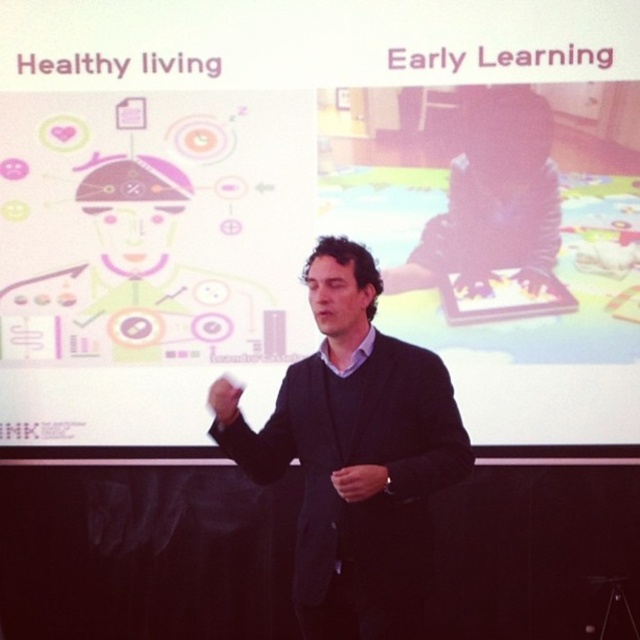
You are an event planner setting up a presentation. The venue has a stage with limited space. You need to place a podium between the white matte projection screen at upper center and the dark blue suit at center. Since the screen is wider than the suit, where should you position the podium to ensure it is centered between them?

The white matte projection screen at upper center is wider than the dark blue suit at center. To center the podium between them, place it closer to the screen side since the screen occupies more horizontal space, balancing the setup.

You are an attendee at the presentation and want to take a photo of the dark blue suit at center and the white matte projection screen at upper center. Which object should you focus on first to ensure both are in frame?

You should focus on the dark blue suit at center first because the white matte projection screen at upper center is above it, so adjusting the camera angle to include both would require framing from the lower subject upwards.

You are an attendee at the presentation and want to take a photo of the dark blue suit at center and the white matte projection screen at upper center. Which object should you focus on first if you want to capture both in one frame without moving your camera?

The white matte projection screen at upper center is to the left of the dark blue suit at center, so you should focus on the white matte projection screen at upper center first to ensure both are in frame.